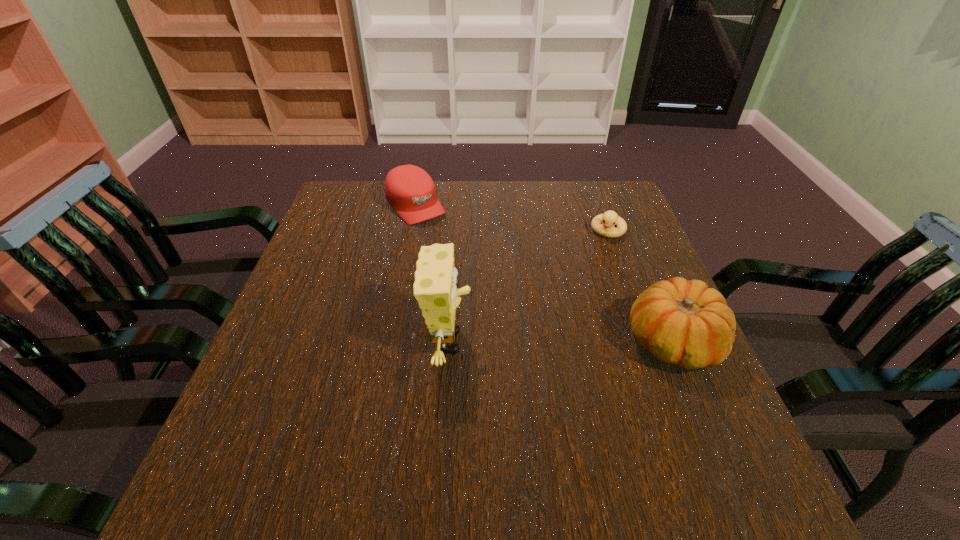
Identify which object is the second nearest to the third tallest object. Please provide its 2D coordinates. Your answer should be formatted as a tuple, i.e. [(x, y)], where the tuple contains the x and y coordinates of a point satisfying the conditions above.

[(610, 218)]

This screenshot has width=960, height=540. Find the location of `object identified as the second closest to the gourd`. object identified as the second closest to the gourd is located at coordinates (435, 290).

Identify the location of vacant space that satisfies the following two spatial constraints: 1. on the front side of the cap; 2. on the right side of the duckling. (411, 230).

The height and width of the screenshot is (540, 960). Identify the location of free space that satisfies the following two spatial constraints: 1. on the front side of the sponge; 2. on the face of the cap. click(389, 342).

In order to click on free region that satisfies the following two spatial constraints: 1. on the front side of the tallest object; 2. on the face of the cap in this screenshot , I will do `click(389, 342)`.

I want to click on vacant area that satisfies the following two spatial constraints: 1. on the front side of the gourd; 2. on the right side of the shortest object, so click(x=649, y=342).

At what (x,y) coordinates should I click in order to perform the action: click on free location that satisfies the following two spatial constraints: 1. on the front side of the gourd; 2. on the right side of the duckling. Please return your answer as a coordinate pair (x, y). The height and width of the screenshot is (540, 960). Looking at the image, I should click on (649, 342).